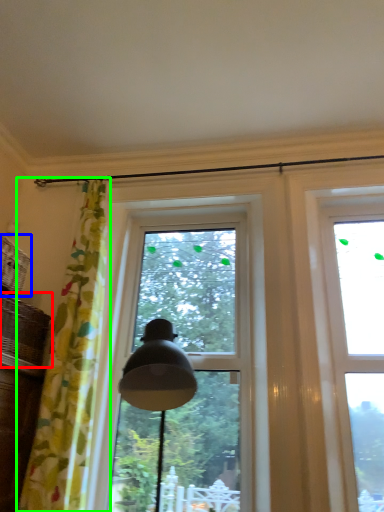
Question: Considering the real-world distances, which object is closest to basket (highlighted by a red box)? basket (highlighted by a blue box) or curtain (highlighted by a green box).

Choices:
 (A) basket
 (B) curtain

Answer: (A)